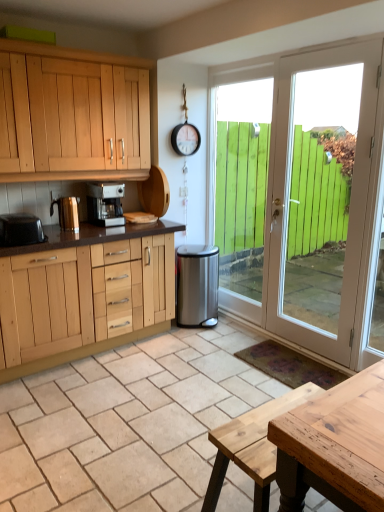
Question: From the image's perspective, is black plastic toaster at left, which is counted as the 3th appliance, starting from the right, beneath satin silver coffee machine at upper center?

Choices:
 (A) yes
 (B) no

Answer: (A)

Question: From the image's perspective, would you say black plastic toaster at left, which appears as the 3th appliance when viewed from the back, is positioned over satin silver coffee machine at upper center?

Choices:
 (A) no
 (B) yes

Answer: (A)

Question: Is satin silver coffee machine at upper center completely or partially inside black plastic toaster at left, which is the first appliance from left to right?

Choices:
 (A) yes
 (B) no

Answer: (B)

Question: Is black plastic toaster at left, which is counted as the 3th appliance, starting from the right, positioned behind satin silver coffee machine at upper center?

Choices:
 (A) no
 (B) yes

Answer: (A)

Question: Is black plastic toaster at left, which is counted as the 3th appliance, starting from the right, aimed at satin silver coffee machine at upper center?

Choices:
 (A) no
 (B) yes

Answer: (A)

Question: Based on their positions, is white wood door at right located to the left or right of green wooden door at right?

Choices:
 (A) left
 (B) right

Answer: (B)

Question: From a real-world perspective, is white wood door at right above or below green wooden door at right?

Choices:
 (A) above
 (B) below

Answer: (B)

Question: Considering their positions, is white wood door at right located in front of or behind green wooden door at right?

Choices:
 (A) behind
 (B) front

Answer: (B)

Question: From the image's perspective, is white wood door at right positioned above or below green wooden door at right?

Choices:
 (A) below
 (B) above

Answer: (A)

Question: In terms of height, does polished gold kettle at left, the 2th appliance viewed from the left, look taller or shorter compared to stainless steel trash can at center, the 3th appliance viewed from the left?

Choices:
 (A) tall
 (B) short

Answer: (B)

Question: Is point (66, 226) closer or farther from the camera than point (183, 262)?

Choices:
 (A) farther
 (B) closer

Answer: (B)

Question: Based on their positions, is polished gold kettle at left, positioned as the 2th appliance in back-to-front order, located to the left or right of stainless steel trash can at center, the 1th appliance from the right?

Choices:
 (A) left
 (B) right

Answer: (A)

Question: From the image's perspective, is polished gold kettle at left, positioned as the 2th appliance in back-to-front order, above or below stainless steel trash can at center, the 3th appliance viewed from the left?

Choices:
 (A) above
 (B) below

Answer: (A)

Question: Considering the positions of natural stone tile at center and natural wood picnic table at center in the image, is natural stone tile at center wider or thinner than natural wood picnic table at center?

Choices:
 (A) wide
 (B) thin

Answer: (A)

Question: From a real-world perspective, relative to natural wood picnic table at center, is natural stone tile at center vertically above or below?

Choices:
 (A) below
 (B) above

Answer: (A)